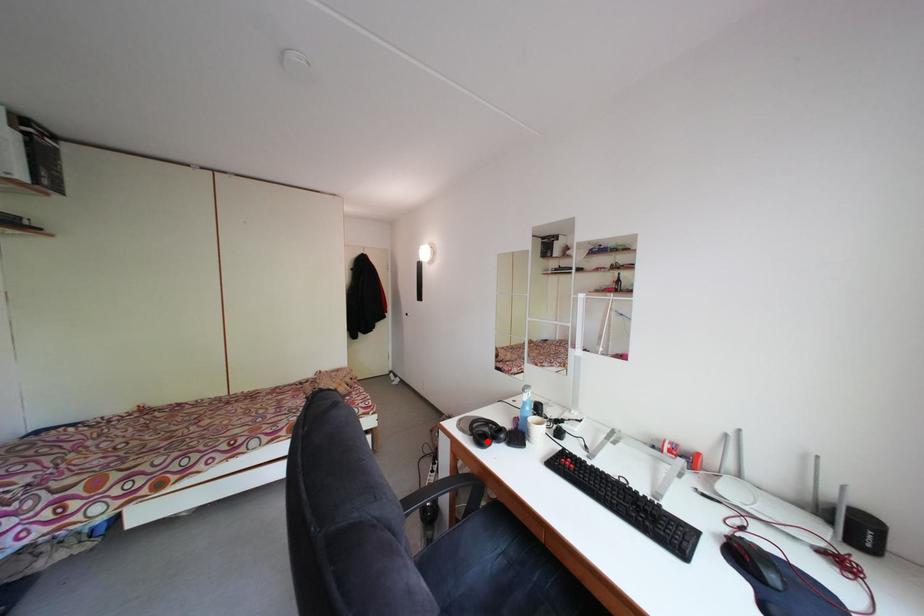
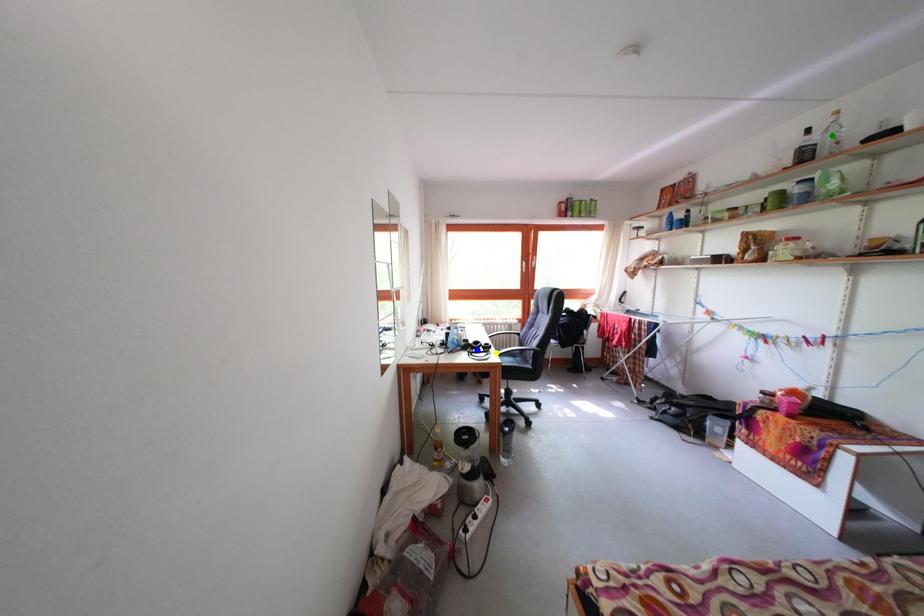
Question: I am providing you with two images of the same scene from different viewpoints. A red point is marked on the first image. You are given multiple points on the second image. Which mark in image 2 goes with the point in image 1?

Choices:
 (A) green point
 (B) yellow point
 (C) blue point

Answer: (B)